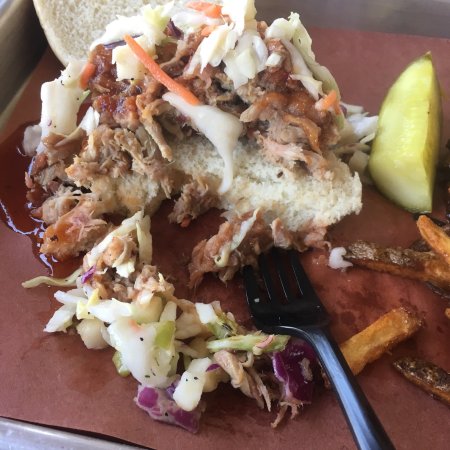
Where is `handle`? The height and width of the screenshot is (450, 450). handle is located at coordinates (354, 396).